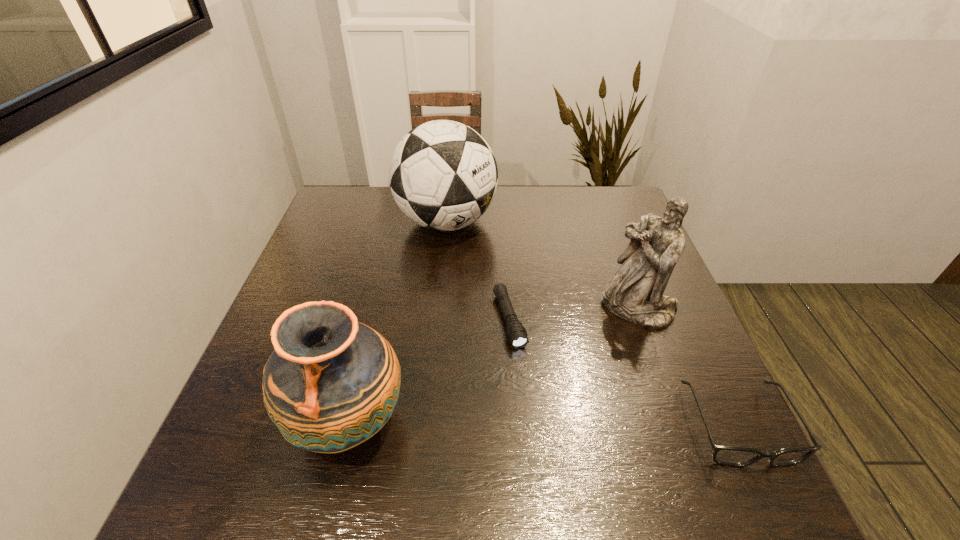
The height and width of the screenshot is (540, 960). Find the location of `pottery`. pottery is located at coordinates (332, 383).

Identify the location of spectacles. The width and height of the screenshot is (960, 540). (734, 456).

This screenshot has height=540, width=960. What are the coordinates of `figurine` in the screenshot? It's located at (635, 293).

Find the location of a particular element. the farthest object is located at coordinates (443, 175).

Find the location of a particular element. Image resolution: width=960 pixels, height=540 pixels. flashlight is located at coordinates (517, 335).

Image resolution: width=960 pixels, height=540 pixels. What are the coordinates of `vacant space situated on the back of the pottery` in the screenshot? It's located at [374, 313].

Locate an element on the screen. Image resolution: width=960 pixels, height=540 pixels. free location located on the front-facing side of the figurine is located at coordinates (528, 422).

Identify the location of free space located 0.230m on the front-facing side of the figurine. The image size is (960, 540). (562, 386).

The image size is (960, 540). In order to click on vacant space situated 0.280m on the front-facing side of the figurine in this screenshot , I will do `click(547, 402)`.

You are a GUI agent. You are given a task and a screenshot of the screen. Output one action in this format:
    pyautogui.click(x=<x>, y=<y>)
    Task: Click on the vacant space located on the surface of the farthest object where the brand logo is visible
    Image resolution: width=960 pixels, height=540 pixels.
    Given the screenshot: What is the action you would take?
    pyautogui.click(x=475, y=279)